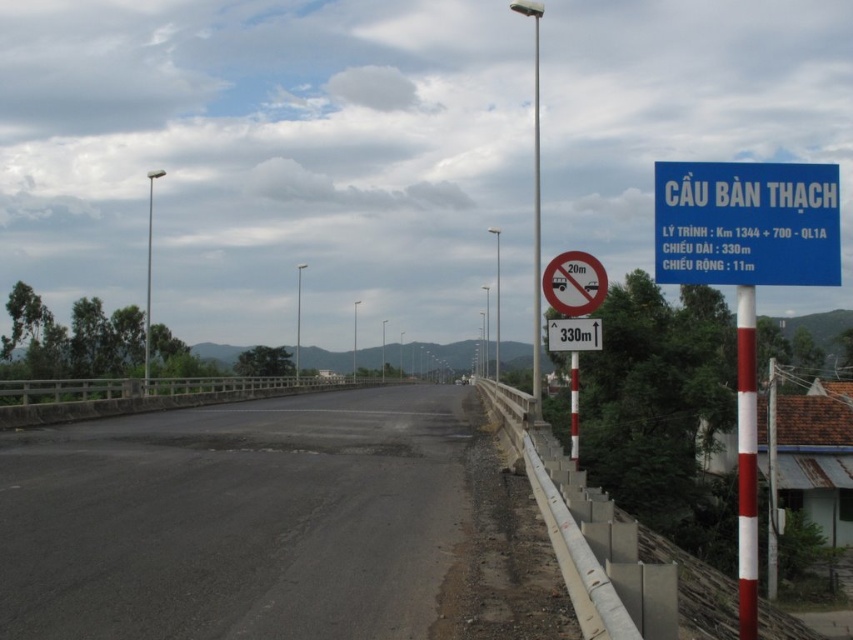
You are driving a car on the road and see two points marked on the map. The first point is at coordinates point (389, 538) and the second is at point (744, 301). According to the scene description, which point is closer to your current position if you are facing the direction the road is going?

Point (744, 301) is closer to your current position because it is in front of point (389, 538) when facing the direction of the road.